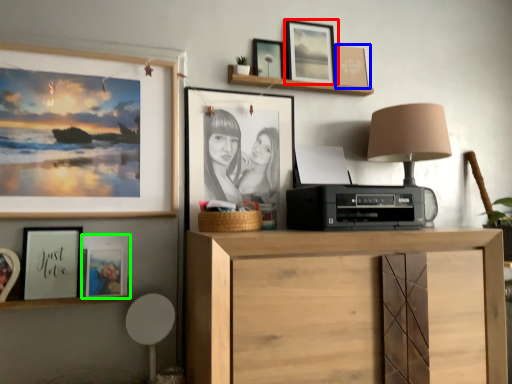
Question: Considering the real-world distances, which object is farthest from picture frame (highlighted by a red box)? picture frame (highlighted by a blue box) or picture frame (highlighted by a green box)?

Choices:
 (A) picture frame
 (B) picture frame

Answer: (B)